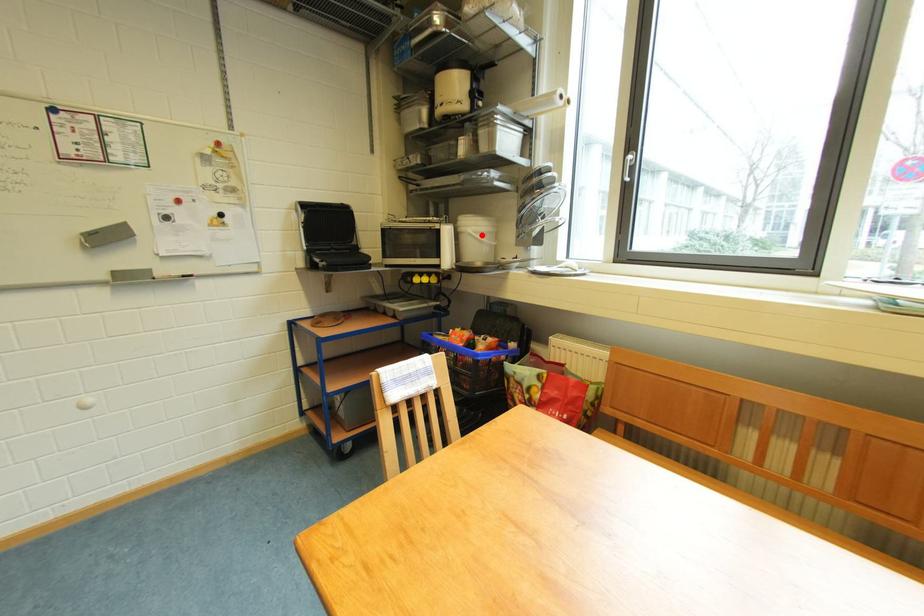
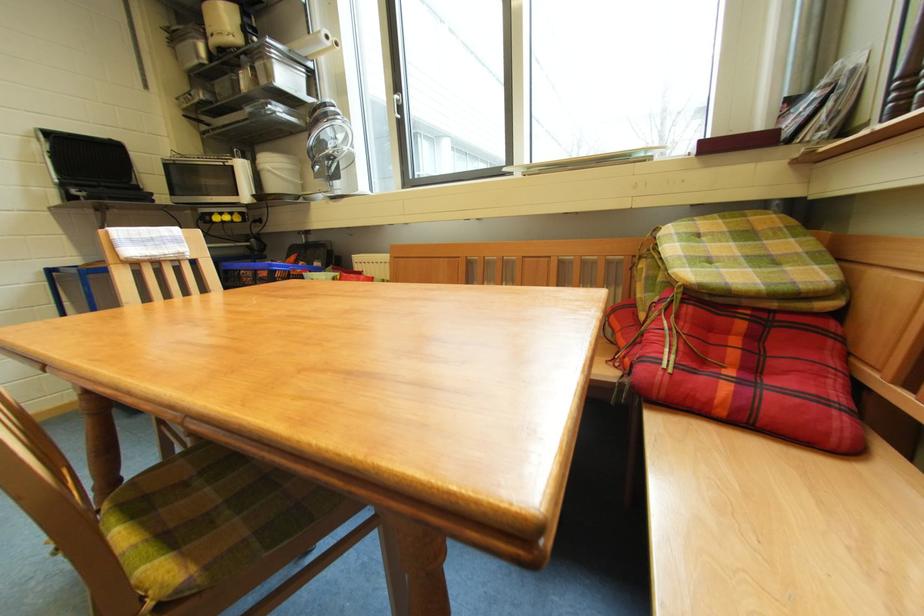
Find the pixel in the second image that matches the highlighted location in the first image.

(281, 171)